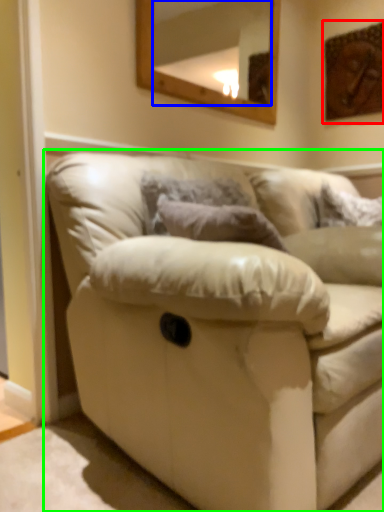
Question: Considering the real-world distances, which object is closest to picture frame (highlighted by a red box)? mirror (highlighted by a blue box) or studio couch (highlighted by a green box).

Choices:
 (A) mirror
 (B) studio couch

Answer: (A)